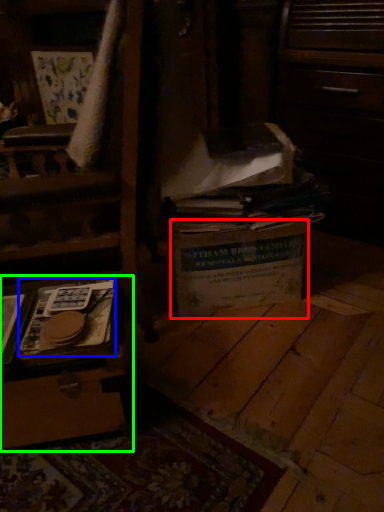
Question: Considering the real-world distances, which object is farthest from cardboard box (highlighted by a red box)? paperback book (highlighted by a blue box) or vanity (highlighted by a green box)?

Choices:
 (A) paperback book
 (B) vanity

Answer: (B)